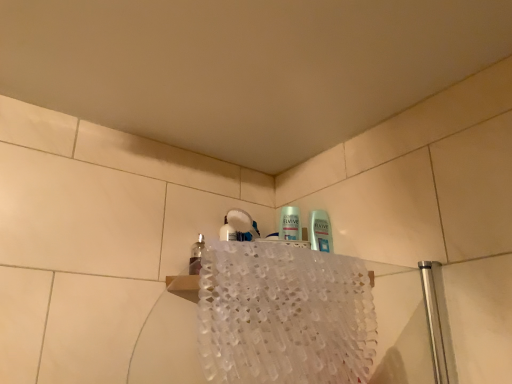
Identify the location of transparent glass mouthwash at upper left. This screenshot has width=512, height=384. (196, 256).

This screenshot has width=512, height=384. What do you see at coordinates (196, 256) in the screenshot? I see `transparent glass mouthwash at upper left` at bounding box center [196, 256].

The height and width of the screenshot is (384, 512). Describe the element at coordinates (284, 315) in the screenshot. I see `white lace bath towel at upper center` at that location.

I want to click on white lace bath towel at upper center, so click(284, 315).

Where is `transparent glass mouthwash at upper left`? transparent glass mouthwash at upper left is located at coordinates (196, 256).

Considering the positions of objects transparent glass mouthwash at upper left and white lace bath towel at upper center in the image provided, who is more to the left, transparent glass mouthwash at upper left or white lace bath towel at upper center?

transparent glass mouthwash at upper left.

Between transparent glass mouthwash at upper left and white lace bath towel at upper center, which one is positioned in front?

white lace bath towel at upper center.

Is point (194, 256) farther from camera compared to point (268, 336)?

No, it is in front of (268, 336).

From the image's perspective, between transparent glass mouthwash at upper left and white lace bath towel at upper center, who is located below?

white lace bath towel at upper center.

From a real-world perspective, does transparent glass mouthwash at upper left stand above white lace bath towel at upper center?

Yes.

Does transparent glass mouthwash at upper left have a lesser width compared to white lace bath towel at upper center?

Yes.

In terms of height, does transparent glass mouthwash at upper left look taller or shorter compared to white lace bath towel at upper center?

Clearly, transparent glass mouthwash at upper left is shorter compared to white lace bath towel at upper center.

Based on their sizes in the image, would you say transparent glass mouthwash at upper left is bigger or smaller than white lace bath towel at upper center?

Considering their sizes, transparent glass mouthwash at upper left takes up less space than white lace bath towel at upper center.

Is transparent glass mouthwash at upper left completely or partially outside of white lace bath towel at upper center?

Absolutely, transparent glass mouthwash at upper left is external to white lace bath towel at upper center.

Would you consider transparent glass mouthwash at upper left to be distant from white lace bath towel at upper center?

transparent glass mouthwash at upper left is near white lace bath towel at upper center, not far away.

Could you tell me if transparent glass mouthwash at upper left is facing white lace bath towel at upper center?

No, transparent glass mouthwash at upper left is not oriented towards white lace bath towel at upper center.

The width and height of the screenshot is (512, 384). What are the coordinates of `mouthwash lying on the left of white lace bath towel at upper center` in the screenshot? It's located at (196, 256).

Is white lace bath towel at upper center at the left side of transparent glass mouthwash at upper left?

No.

Relative to transparent glass mouthwash at upper left, is white lace bath towel at upper center in front or behind?

Clearly, white lace bath towel at upper center is in front of transparent glass mouthwash at upper left.

Which is behind, point (199, 349) or point (201, 238)?

The point (201, 238) is more distant.

From the image's perspective, is white lace bath towel at upper center over transparent glass mouthwash at upper left?

Actually, white lace bath towel at upper center appears below transparent glass mouthwash at upper left in the image.

From a real-world perspective, which is physically below, white lace bath towel at upper center or transparent glass mouthwash at upper left?

From a 3D spatial view, white lace bath towel at upper center is below.

Does white lace bath towel at upper center have a greater width compared to transparent glass mouthwash at upper left?

Indeed, white lace bath towel at upper center has a greater width compared to transparent glass mouthwash at upper left.

Based on the photo, does white lace bath towel at upper center have a greater height compared to transparent glass mouthwash at upper left?

Yes, white lace bath towel at upper center is taller than transparent glass mouthwash at upper left.

Does white lace bath towel at upper center have a smaller size compared to transparent glass mouthwash at upper left?

Incorrect, white lace bath towel at upper center is not smaller in size than transparent glass mouthwash at upper left.

Choose the correct answer: Is white lace bath towel at upper center inside transparent glass mouthwash at upper left or outside it?

white lace bath towel at upper center is outside transparent glass mouthwash at upper left.

Is white lace bath towel at upper center beside transparent glass mouthwash at upper left?

There is a gap between white lace bath towel at upper center and transparent glass mouthwash at upper left.

Is white lace bath towel at upper center aimed at transparent glass mouthwash at upper left?

No, white lace bath towel at upper center is not facing towards transparent glass mouthwash at upper left.

How many degrees apart are the facing directions of white lace bath towel at upper center and transparent glass mouthwash at upper left?

The angle between the facing direction of white lace bath towel at upper center and the facing direction of transparent glass mouthwash at upper left is 41.5 degrees.

Find the location of `bath towel that appears in front of the transparent glass mouthwash at upper left`. bath towel that appears in front of the transparent glass mouthwash at upper left is located at coordinates (284, 315).

I want to click on mouthwash that is above the white lace bath towel at upper center (from the image's perspective), so click(x=196, y=256).

Image resolution: width=512 pixels, height=384 pixels. I want to click on mouthwash that is above the white lace bath towel at upper center (from a real-world perspective), so click(196, 256).